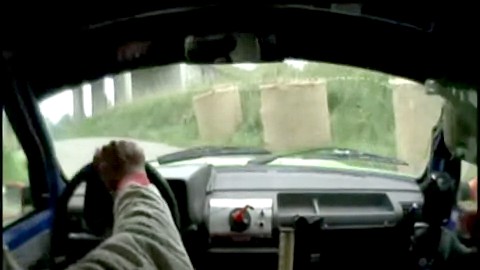
At what (x,y) coordinates should I click in order to perform the action: click on vent. Please return your answer as a coordinate pair (x, y). This screenshot has height=270, width=480. Looking at the image, I should click on (405, 206).